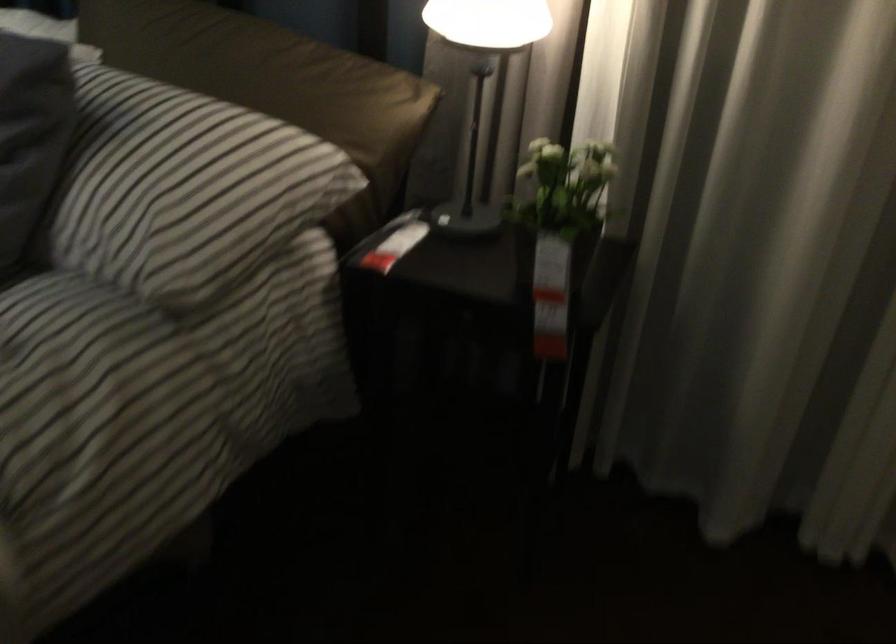
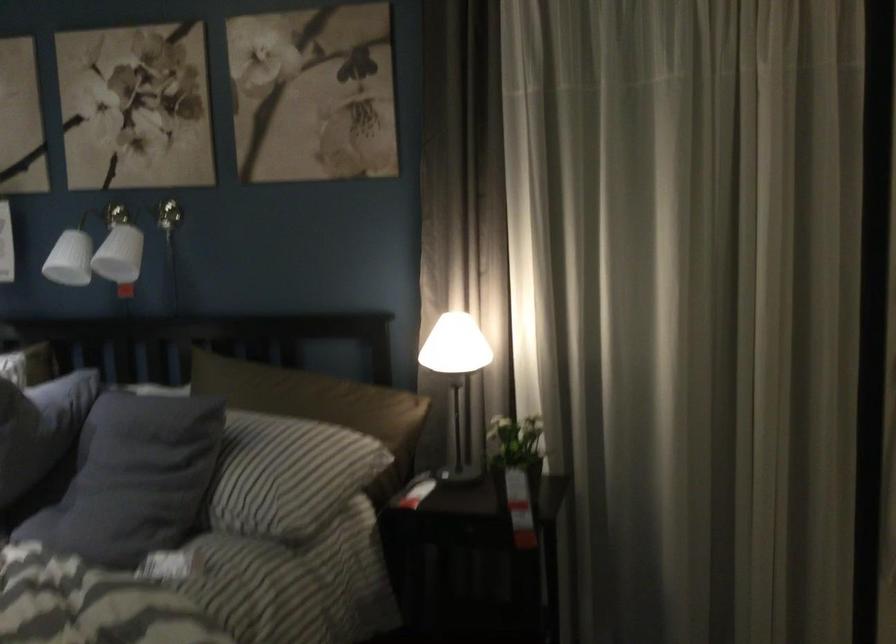
Where in the second image is the point corresponding to point 169,185 from the first image?

(280, 471)